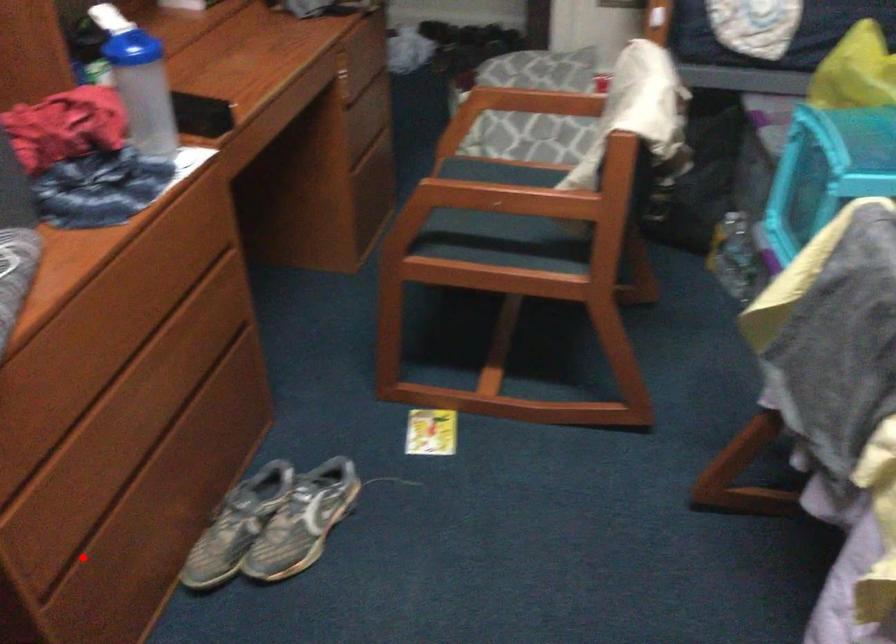
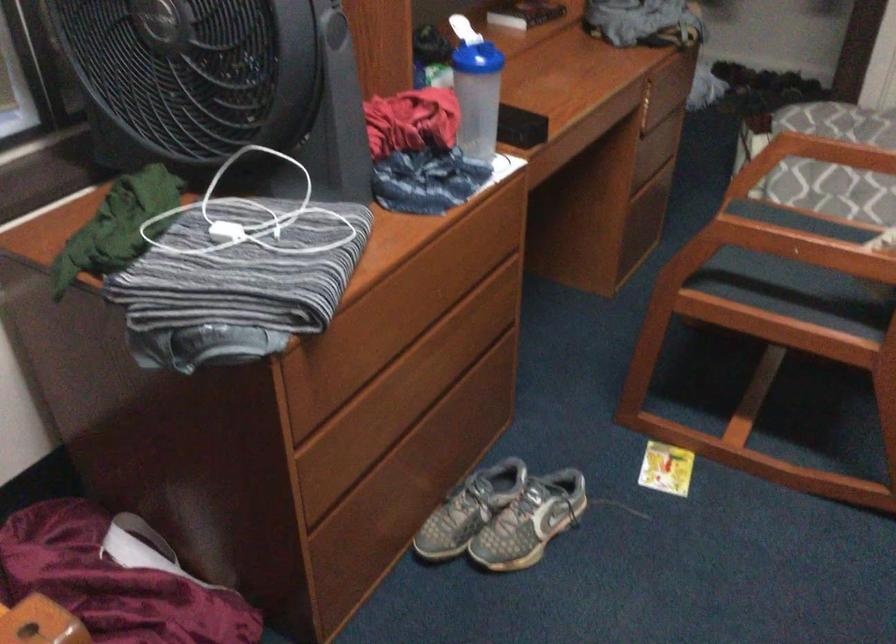
In the second image, find the point that corresponds to the highlighted location in the first image.

(343, 506)